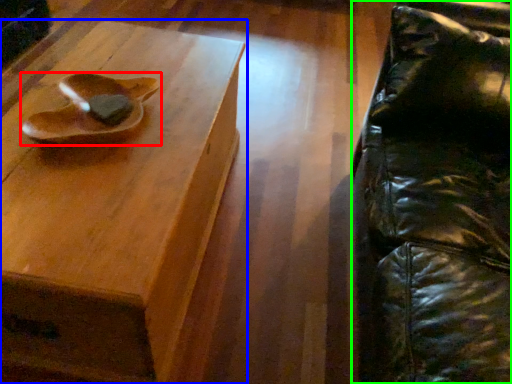
Question: Estimate the real-world distances between objects in this image. Which object is farther from footwear (highlighted by a red box), table (highlighted by a blue box) or swivel chair (highlighted by a green box)?

Choices:
 (A) table
 (B) swivel chair

Answer: (B)